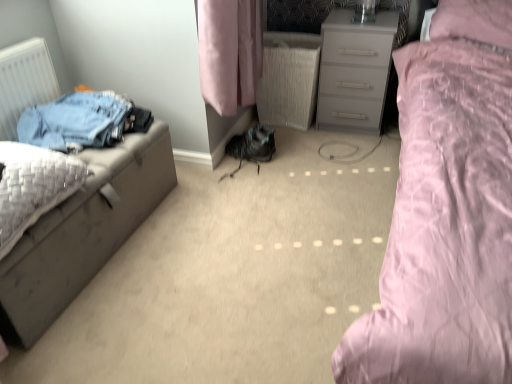
You are a GUI agent. You are given a task and a screenshot of the screen. Output one action in this format:
    pyautogui.click(x=<x>, y=<y>)
    Task: Click on the free space in front of matte gray chest of drawers at center
    
    Given the screenshot: What is the action you would take?
    pyautogui.click(x=350, y=151)